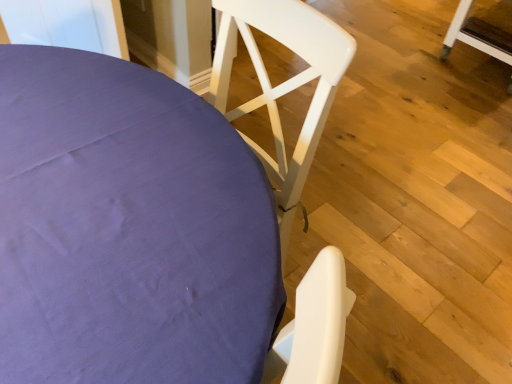
Question: Is white wood chair at upper center, the 1th chair when ordered from bottom to top, aimed at white wood chair at upper right, positioned as the 2th chair in front-to-back order?

Choices:
 (A) yes
 (B) no

Answer: (B)

Question: Is white wood chair at upper center, which appears as the 2th chair when viewed from the right, thinner than white wood chair at upper right, placed as the second chair when sorted from left to right?

Choices:
 (A) yes
 (B) no

Answer: (B)

Question: From the image's perspective, does white wood chair at upper center, which appears as the 2th chair when viewed from the right, appear lower than white wood chair at upper right, the 2th chair in the bottom-to-top sequence?

Choices:
 (A) yes
 (B) no

Answer: (A)

Question: Is white wood chair at upper center, which is the first chair from front to back, next to white wood chair at upper right, the first chair positioned from the right?

Choices:
 (A) no
 (B) yes

Answer: (A)

Question: Can you confirm if white wood chair at upper center, the 1th chair when ordered from bottom to top, is positioned to the right of white wood chair at upper right, which is the first chair from back to front?

Choices:
 (A) no
 (B) yes

Answer: (A)

Question: From a real-world perspective, is white wood chair at upper center, which is the first chair from front to back, positioned over white wood chair at upper right, the 2th chair in the bottom-to-top sequence, based on gravity?

Choices:
 (A) no
 (B) yes

Answer: (B)

Question: Is the position of white wood chair at upper right, positioned as the 2th chair in front-to-back order, more distant than that of white wood chair at upper center, which is the first chair from front to back?

Choices:
 (A) no
 (B) yes

Answer: (B)

Question: From the image's perspective, is white wood chair at upper right, placed as the second chair when sorted from left to right, under white wood chair at upper center, which is the first chair from front to back?

Choices:
 (A) yes
 (B) no

Answer: (B)

Question: Does white wood chair at upper right, positioned as the 2th chair in front-to-back order, have a lesser height compared to white wood chair at upper center, the 1th chair positioned from the left?

Choices:
 (A) no
 (B) yes

Answer: (B)

Question: From the image's perspective, would you say white wood chair at upper right, placed as the second chair when sorted from left to right, is positioned over white wood chair at upper center, which appears as the 2th chair when viewed from the right?

Choices:
 (A) yes
 (B) no

Answer: (A)

Question: Can you confirm if white wood chair at upper right, placed as the second chair when sorted from left to right, is bigger than white wood chair at upper center, the 2th chair from the back?

Choices:
 (A) no
 (B) yes

Answer: (A)

Question: Is white wood chair at upper right, arranged as the 1th chair when viewed from the top, thinner than white wood chair at upper center, which appears as the 2th chair when viewed from the right?

Choices:
 (A) yes
 (B) no

Answer: (A)

Question: From their relative heights in the image, would you say white wood chair at upper center, the 2th chair from the back, is taller or shorter than white wood chair at upper right, the 2th chair in the bottom-to-top sequence?

Choices:
 (A) short
 (B) tall

Answer: (B)